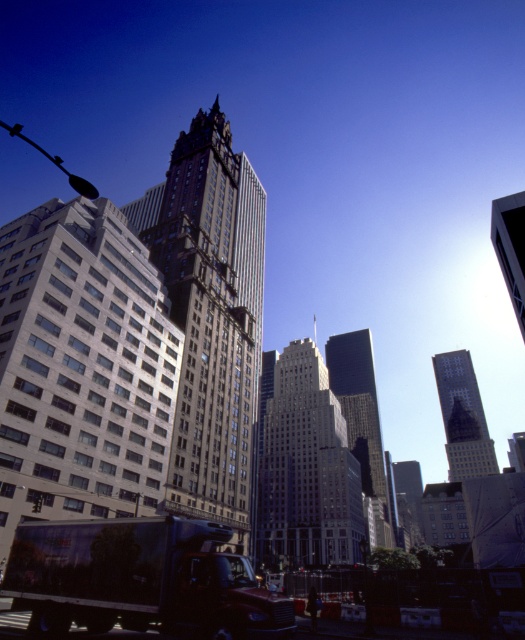
Question: Is gray stone building at center to the left of reflective glass skyscraper at center from the viewer's perspective?

Choices:
 (A) yes
 (B) no

Answer: (A)

Question: Can you confirm if metallic silver truck at lower left is positioned below glassy reflective skyscraper at center?

Choices:
 (A) no
 (B) yes

Answer: (A)

Question: Can you confirm if shiny glass skyscraper at center is smaller than smooth gray skyscraper at center?

Choices:
 (A) yes
 (B) no

Answer: (B)

Question: Among these objects, which one is nearest to the camera?

Choices:
 (A) smooth gray skyscraper at center
 (B) reflective glass skyscraper at center
 (C) glassy reflective skyscraper at center

Answer: (A)

Question: Estimate the real-world distances between objects in this image. Which object is farther from the gray stone building at center?

Choices:
 (A) reflective glass skyscraper at center
 (B) metallic silver truck at lower left
 (C) shiny glass skyscraper at center

Answer: (A)

Question: Among these points, which one is nearest to the camera?

Choices:
 (A) (26, 289)
 (B) (481, 442)
 (C) (338, 355)
 (D) (261, 289)

Answer: (A)